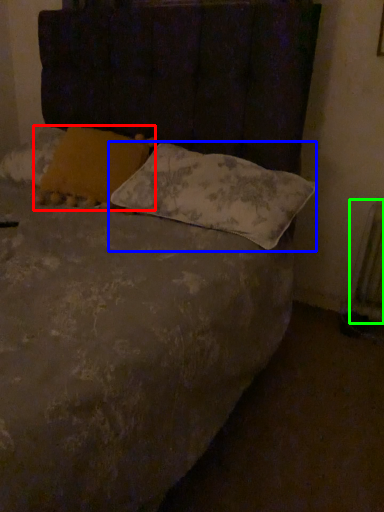
Question: Which object is positioned farthest from pillow (highlighted by a red box)? Select from pillow (highlighted by a blue box) and radiator (highlighted by a green box).

Choices:
 (A) pillow
 (B) radiator

Answer: (B)